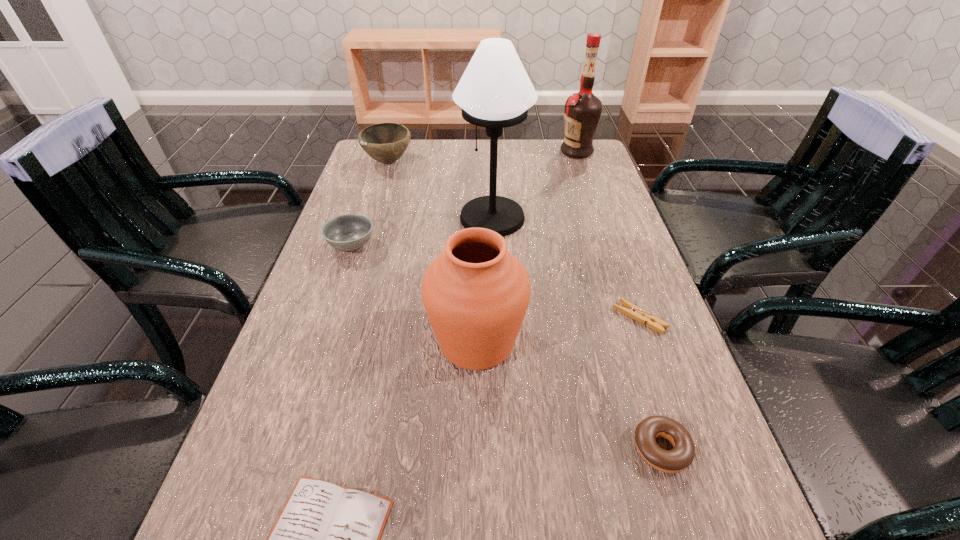
This screenshot has height=540, width=960. Find the location of `empty space between the sixth shortest object and the fourth shortest object`. empty space between the sixth shortest object and the fourth shortest object is located at coordinates (414, 294).

At what (x,y) coordinates should I click in order to perform the action: click on unoccupied area between the liquor and the fifth tallest object. Please return your answer as a coordinate pair (x, y). Looking at the image, I should click on (464, 199).

You are a GUI agent. You are given a task and a screenshot of the screen. Output one action in this format:
    pyautogui.click(x=<x>, y=<y>)
    Task: Click on the vacant area that lies between the fifth shortest object and the nearer bowl
    
    Given the screenshot: What is the action you would take?
    pyautogui.click(x=370, y=204)

Select which object is the third closest to the urn. Please provide its 2D coordinates. Your answer should be formatted as a tuple, i.e. [(x, y)], where the tuple contains the x and y coordinates of a point satisfying the conditions above.

[(632, 311)]

Where is `object that stands as the fifth closest to the shorter bowl`? The height and width of the screenshot is (540, 960). object that stands as the fifth closest to the shorter bowl is located at coordinates (632, 311).

At what (x,y) coordinates should I click in order to perform the action: click on free location that satisfies the following two spatial constraints: 1. on the back side of the doughnut; 2. on the right side of the clothespin. Please return your answer as a coordinate pair (x, y). This screenshot has height=540, width=960. Looking at the image, I should click on (621, 318).

You are a GUI agent. You are given a task and a screenshot of the screen. Output one action in this format:
    pyautogui.click(x=<x>, y=<y>)
    Task: Click on the vacant area that satisfies the following two spatial constraints: 1. on the front side of the nearer bowl; 2. on the left side of the doughnut
    The height and width of the screenshot is (540, 960).
    Given the screenshot: What is the action you would take?
    pyautogui.click(x=283, y=448)